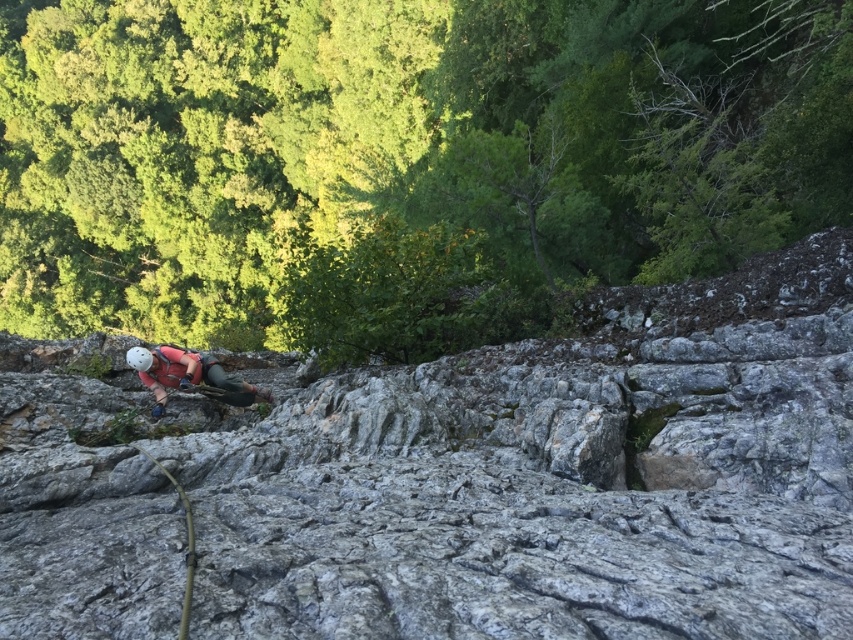
Question: Where is gray rough rock at center located in relation to matte pink climbing harness at center in the image?

Choices:
 (A) left
 (B) right

Answer: (B)

Question: Which object is farther from the camera taking this photo?

Choices:
 (A) greenish-gray rubber rope at lower left
 (B) matte pink climbing harness at center
 (C) gray rough rock at center

Answer: (B)

Question: Among these points, which one is nearest to the camera?

Choices:
 (A) (42, 390)
 (B) (189, 586)
 (C) (142, 369)

Answer: (B)

Question: Can you confirm if gray rough rock at center is thinner than greenish-gray rubber rope at lower left?

Choices:
 (A) yes
 (B) no

Answer: (B)

Question: Considering the real-world distances, which object is closest to the greenish-gray rubber rope at lower left?

Choices:
 (A) matte pink climbing harness at center
 (B) gray rough rock at center

Answer: (B)

Question: Can you confirm if matte pink climbing harness at center is positioned below greenish-gray rubber rope at lower left?

Choices:
 (A) yes
 (B) no

Answer: (B)